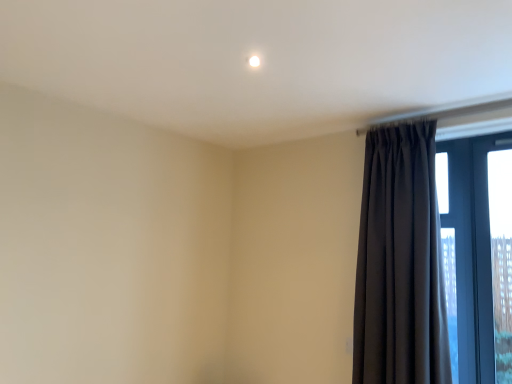
The width and height of the screenshot is (512, 384). What do you see at coordinates (400, 263) in the screenshot?
I see `dark matte curtain at right` at bounding box center [400, 263].

What is the approximate height of dark matte curtain at right?

dark matte curtain at right is 4.35 feet in height.

Where is `dark matte curtain at right`? dark matte curtain at right is located at coordinates (400, 263).

In order to face dark matte curtain at right, should I rotate leftwards or rightwards?

A 16.784 degree turn to the right will do.

This screenshot has height=384, width=512. What do you see at coordinates (477, 254) in the screenshot?
I see `clear glass window at right` at bounding box center [477, 254].

Measure the distance between clear glass window at right and camera.

The depth of clear glass window at right is 3.18 meters.

You are a GUI agent. You are given a task and a screenshot of the screen. Output one action in this format:
    pyautogui.click(x=<x>, y=<y>)
    Task: Click on the clear glass window at right
    The height and width of the screenshot is (384, 512).
    Given the screenshot: What is the action you would take?
    tap(477, 254)

You are a GUI agent. You are given a task and a screenshot of the screen. Output one action in this format:
    pyautogui.click(x=<x>, y=<y>)
    Task: Click on the dark matte curtain at right
    The width and height of the screenshot is (512, 384).
    Given the screenshot: What is the action you would take?
    pyautogui.click(x=400, y=263)

Which is more to the right, clear glass window at right or dark matte curtain at right?

From the viewer's perspective, clear glass window at right appears more on the right side.

Based on the photo, between clear glass window at right and dark matte curtain at right, which one is positioned behind?

Positioned behind is clear glass window at right.

Does point (497, 316) come behind point (386, 161)?

Yes, point (497, 316) is farther from viewer.

Looking at this image, from the image's perspective, is clear glass window at right on top of dark matte curtain at right?

No.

From a real-world perspective, is clear glass window at right located higher than dark matte curtain at right?

Yes, from a real-world perspective, clear glass window at right is on top of dark matte curtain at right.

Looking at their sizes, would you say clear glass window at right is wider or thinner than dark matte curtain at right?

In the image, clear glass window at right appears to be more narrow than dark matte curtain at right.

Between clear glass window at right and dark matte curtain at right, which one has less height?

Standing shorter between the two is clear glass window at right.

Is clear glass window at right smaller than dark matte curtain at right?

Yes, clear glass window at right is smaller than dark matte curtain at right.

Would you say clear glass window at right contains dark matte curtain at right?

That's incorrect, dark matte curtain at right is not inside clear glass window at right.

Is clear glass window at right not near dark matte curtain at right?

Yes, clear glass window at right and dark matte curtain at right are located far from each other.

Does clear glass window at right turn towards dark matte curtain at right?

No.

Can you tell me how much clear glass window at right and dark matte curtain at right differ in facing direction?

clear glass window at right and dark matte curtain at right are facing 3.49 degrees away from each other.

Measure the distance from clear glass window at right to dark matte curtain at right.

clear glass window at right is 6.02 feet from dark matte curtain at right.

In order to click on curtain in front of the clear glass window at right in this screenshot , I will do `click(400, 263)`.

Considering the positions of objects dark matte curtain at right and clear glass window at right in the image provided, who is more to the right, dark matte curtain at right or clear glass window at right?

Positioned to the right is clear glass window at right.

Does dark matte curtain at right lie behind clear glass window at right?

No, dark matte curtain at right is closer to the camera.

Is point (368, 300) in front of point (466, 376)?

Yes.

From the image's perspective, who appears lower, dark matte curtain at right or clear glass window at right?

clear glass window at right.

From a real-world perspective, does dark matte curtain at right stand above clear glass window at right?

No.

Which object is wider, dark matte curtain at right or clear glass window at right?

With larger width is dark matte curtain at right.

Looking at this image, between dark matte curtain at right and clear glass window at right, which one has more height?

Standing taller between the two is dark matte curtain at right.

Considering the sizes of objects dark matte curtain at right and clear glass window at right in the image provided, who is smaller, dark matte curtain at right or clear glass window at right?

clear glass window at right is smaller.

Is dark matte curtain at right positioned beyond the bounds of clear glass window at right?

dark matte curtain at right is positioned outside clear glass window at right.

Are dark matte curtain at right and clear glass window at right located far from each other?

Indeed, dark matte curtain at right is not near clear glass window at right.

Does dark matte curtain at right turn towards clear glass window at right?

No, dark matte curtain at right is not turned towards clear glass window at right.

Consider the image. Can you tell me how much dark matte curtain at right and clear glass window at right differ in facing direction?

There is a 3.49-degree angle between the facing directions of dark matte curtain at right and clear glass window at right.

What are the coordinates of `curtain above the clear glass window at right (from the image's perspective)` in the screenshot? It's located at (x=400, y=263).

The height and width of the screenshot is (384, 512). Identify the location of window positioned vertically above the dark matte curtain at right (from a real-world perspective). (477, 254).

The image size is (512, 384). In the image, there is a clear glass window at right. What are the coordinates of `curtain below it (from a real-world perspective)` in the screenshot? It's located at (400, 263).